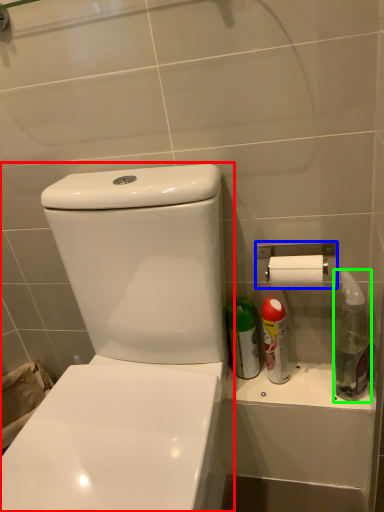
Question: Which object is positioned closest to toilet (highlighted by a red box)? Select from towel bar (highlighted by a blue box) and cleaning product (highlighted by a green box).

Choices:
 (A) towel bar
 (B) cleaning product

Answer: (A)